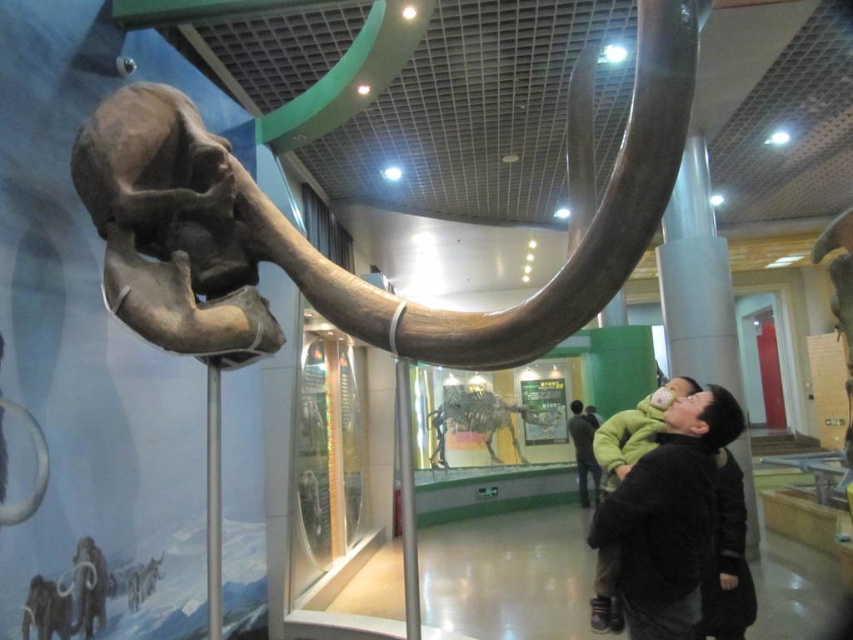
Which of these two, polished gray elephant tusk at upper left or dark gray sweater at center, stands taller?

With more height is dark gray sweater at center.

Consider the image. Can you confirm if polished gray elephant tusk at upper left is wider than dark gray sweater at center?

Correct, the width of polished gray elephant tusk at upper left exceeds that of dark gray sweater at center.

Measure the distance between polished gray elephant tusk at upper left and camera.

polished gray elephant tusk at upper left is 1.20 meters away from camera.

In order to click on polished gray elephant tusk at upper left in this screenshot , I will do `click(329, 260)`.

Between polished gray elephant tusk at upper left and black fuzzy coat at lower right, which one appears on the left side from the viewer's perspective?

polished gray elephant tusk at upper left is more to the left.

Who is taller, polished gray elephant tusk at upper left or black fuzzy coat at lower right?

black fuzzy coat at lower right

Does point (190, 244) lie behind point (718, 412)?

No, it is in front of (718, 412).

At what (x,y) coordinates should I click in order to perform the action: click on polished gray elephant tusk at upper left. Please return your answer as a coordinate pair (x, y). Looking at the image, I should click on (329, 260).

Is point (704, 404) in front of point (579, 483)?

Yes, it is in front of point (579, 483).

Where is `black fuzzy coat at lower right`? black fuzzy coat at lower right is located at coordinates (666, 516).